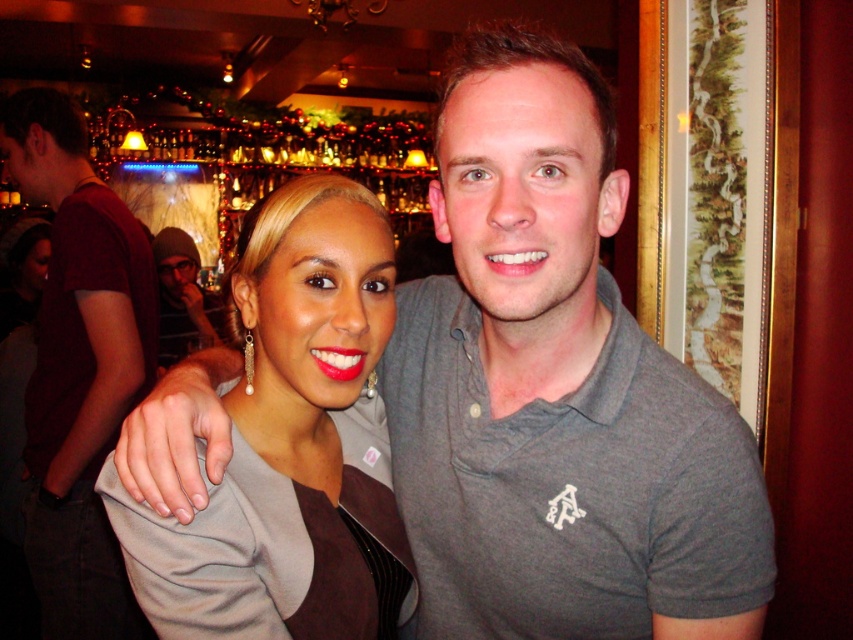
Between dark red t-shirt at left and dark gray hoodie at upper left, which one appears on the right side from the viewer's perspective?

dark red t-shirt at left

Does dark red t-shirt at left have a lesser height compared to dark gray hoodie at upper left?

Incorrect, dark red t-shirt at left's height does not fall short of dark gray hoodie at upper left's.

What do you see at coordinates (78, 368) in the screenshot? I see `dark red t-shirt at left` at bounding box center [78, 368].

The width and height of the screenshot is (853, 640). Find the location of `dark red t-shirt at left`. dark red t-shirt at left is located at coordinates (78, 368).

Which is behind, point (386, 586) or point (167, 308)?

Positioned behind is point (167, 308).

Locate an element on the screen. The width and height of the screenshot is (853, 640). matte gray blazer at center is located at coordinates (291, 444).

Does point (367, 365) lie behind point (177, 348)?

That is False.

At what (x,y) coordinates should I click in order to perform the action: click on matte gray blazer at center. Please return your answer as a coordinate pair (x, y). Image resolution: width=853 pixels, height=640 pixels. Looking at the image, I should click on (291, 444).

How distant is matte gray blazer at center from dark red t-shirt at left?

1.17 meters

Between point (277, 400) and point (51, 531), which one is positioned in front?

Point (277, 400) is more forward.

Between point (265, 298) and point (115, 573), which one is positioned behind?

The point (115, 573) is behind.

This screenshot has height=640, width=853. Find the location of `matte gray blazer at center`. matte gray blazer at center is located at coordinates (291, 444).